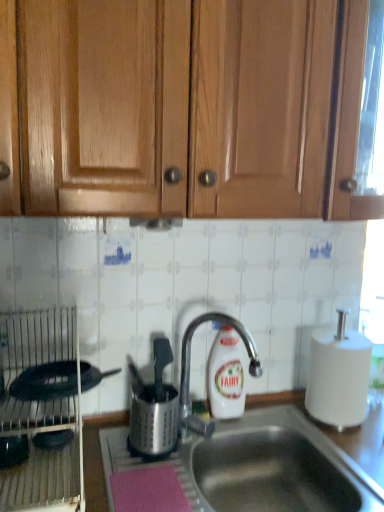
Where is `wooden cabinet doors at upper center`? wooden cabinet doors at upper center is located at coordinates (183, 108).

Describe the element at coordinates (338, 377) in the screenshot. I see `white matte paper towel at right` at that location.

Identify the location of white plastic bottle at center. (226, 375).

Describe the element at coordinates (226, 375) in the screenshot. I see `white plastic bottle at center` at that location.

Where is `stainless steel sink at center`? Image resolution: width=384 pixels, height=512 pixels. stainless steel sink at center is located at coordinates (279, 468).

Identify the location of silver metallic faucet at center. (189, 372).

The width and height of the screenshot is (384, 512). Identify the location of wooden cabinet doors at upper center. (183, 108).

Does white plastic bottle at center come in front of satin silver utensil holder at center, the 1th appliance from the right?

No, white plastic bottle at center is further to the viewer.

Consider the image. Visually, is white plastic bottle at center positioned to the left or to the right of satin silver utensil holder at center, which is counted as the 2th appliance, starting from the left?

white plastic bottle at center is to the right of satin silver utensil holder at center, which is counted as the 2th appliance, starting from the left.

Is point (222, 403) behind point (158, 446)?

Yes, it is.

Is point (337, 346) less distant than point (73, 412)?

No, it is not.

From the image's perspective, relative to metallic silver dish rack at left, which ranks as the first appliance in left-to-right order, is white matte paper towel at right above or below?

Clearly, from the image's perspective, white matte paper towel at right is above metallic silver dish rack at left, which ranks as the first appliance in left-to-right order.

Looking at this image, from a real-world perspective, is white matte paper towel at right physically below metallic silver dish rack at left, the second appliance viewed from the right?

Indeed, from a real-world perspective, white matte paper towel at right is positioned beneath metallic silver dish rack at left, the second appliance viewed from the right.

The width and height of the screenshot is (384, 512). I want to click on appliance that is the 2nd one when counting forward from the white matte paper towel at right, so click(41, 413).

From the image's perspective, is white plastic bottle at center located above or below metallic silver dish rack at left, the second appliance viewed from the right?

From the image's perspective, white plastic bottle at center appears below metallic silver dish rack at left, the second appliance viewed from the right.

Considering the sizes of objects white plastic bottle at center and metallic silver dish rack at left, the second appliance viewed from the right, in the image provided, who is taller, white plastic bottle at center or metallic silver dish rack at left, the second appliance viewed from the right,?

metallic silver dish rack at left, the second appliance viewed from the right.

I want to click on the 2nd appliance in front of the white plastic bottle at center, so click(x=41, y=413).

From the picture: From the image's perspective, which is below, silver metallic faucet at center or wooden cabinet doors at upper center?

silver metallic faucet at center appears lower in the image.

How many degrees apart are the facing directions of silver metallic faucet at center and wooden cabinet doors at upper center?

The angular difference between silver metallic faucet at center and wooden cabinet doors at upper center is 0.548 degrees.

At what (x,y) coordinates should I click in order to perform the action: click on tap that is under the wooden cabinet doors at upper center (from a real-world perspective). Please return your answer as a coordinate pair (x, y). This screenshot has height=512, width=384. Looking at the image, I should click on (189, 372).

Is silver metallic faucet at center located outside wooden cabinet doors at upper center?

silver metallic faucet at center lies outside wooden cabinet doors at upper center's area.

Is wooden cabinet doors at upper center inside stainless steel sink at center?

No.

Which object is closer to the camera taking this photo, stainless steel sink at center or wooden cabinet doors at upper center?

Positioned in front is wooden cabinet doors at upper center.

Considering the relative sizes of stainless steel sink at center and wooden cabinet doors at upper center in the image provided, is stainless steel sink at center thinner than wooden cabinet doors at upper center?

Yes, stainless steel sink at center is thinner than wooden cabinet doors at upper center.

From the picture: Is stainless steel sink at center placed right next to wooden cabinet doors at upper center?

No, stainless steel sink at center is not with wooden cabinet doors at upper center.

Does point (223, 202) come farther from viewer compared to point (244, 391)?

No.

Locate an element on the screen. This screenshot has width=384, height=512. cleaning product directly beneath the wooden cabinet doors at upper center (from a real-world perspective) is located at coordinates (226, 375).

Visually, is wooden cabinet doors at upper center positioned to the left or to the right of white plastic bottle at center?

wooden cabinet doors at upper center is positioned on white plastic bottle at center's right side.

From the image's perspective, which is above, wooden cabinet doors at upper center or white plastic bottle at center?

Answer: wooden cabinet doors at upper center.

Identify the location of tap on the left of white plastic bottle at center. (189, 372).

Considering the sizes of silver metallic faucet at center and white plastic bottle at center in the image, is silver metallic faucet at center taller or shorter than white plastic bottle at center?

In the image, silver metallic faucet at center appears to be taller than white plastic bottle at center.

From the image's perspective, does silver metallic faucet at center appear higher than white plastic bottle at center?

Yes, from the image's perspective, silver metallic faucet at center is over white plastic bottle at center.

The image size is (384, 512). What are the coordinates of `appliance that is under the white plastic bottle at center (from a real-world perspective)` in the screenshot? It's located at (153, 407).

Identify the location of the 1st appliance positioned below the white matte paper towel at right (from the image's perspective). Image resolution: width=384 pixels, height=512 pixels. (41, 413).

When comparing their distances from wooden cabinet doors at upper center, does silver metallic faucet at center or satin silver utensil holder at center, which is counted as the 2th appliance, starting from the left, seem closer?

Among the two, silver metallic faucet at center is located nearer to wooden cabinet doors at upper center.

From the image, which object appears to be nearer to metallic silver dish rack at left, which ranks as the first appliance in left-to-right order, white matte paper towel at right or stainless steel sink at center?

The object closer to metallic silver dish rack at left, which ranks as the first appliance in left-to-right order, is stainless steel sink at center.

When comparing their distances from satin silver utensil holder at center, which is counted as the 2th appliance, starting from the left, does metallic silver dish rack at left, which ranks as the first appliance in left-to-right order, or white matte paper towel at right seem further?

white matte paper towel at right is further to satin silver utensil holder at center, which is counted as the 2th appliance, starting from the left.

Estimate the real-world distances between objects in this image. Which object is further from wooden cabinet doors at upper center, metallic silver dish rack at left, which ranks as the first appliance in left-to-right order, or white matte paper towel at right?

The object further to wooden cabinet doors at upper center is white matte paper towel at right.

From the picture: When comparing their distances from satin silver utensil holder at center, the 1th appliance from the right, does stainless steel sink at center or white plastic bottle at center seem closer?

white plastic bottle at center.

Which object lies further to the anchor point stainless steel sink at center, white matte paper towel at right or wooden cabinet doors at upper center?

Based on the image, wooden cabinet doors at upper center appears to be further to stainless steel sink at center.

When comparing their distances from silver metallic faucet at center, does white plastic bottle at center or metallic silver dish rack at left, which ranks as the first appliance in left-to-right order, seem further?

metallic silver dish rack at left, which ranks as the first appliance in left-to-right order.

Which object lies further to the anchor point wooden cabinet doors at upper center, white matte paper towel at right or silver metallic faucet at center?

The object further to wooden cabinet doors at upper center is white matte paper towel at right.

This screenshot has width=384, height=512. I want to click on appliance between stainless steel sink at center and white plastic bottle at center from front to back, so click(153, 407).

At what (x,y) coordinates should I click in order to perform the action: click on appliance that lies between wooden cabinet doors at upper center and white plastic bottle at center from top to bottom. Please return your answer as a coordinate pair (x, y). This screenshot has height=512, width=384. Looking at the image, I should click on (41, 413).

Where is `appliance between silver metallic faucet at center and white plastic bottle at center in the front-back direction`? The image size is (384, 512). appliance between silver metallic faucet at center and white plastic bottle at center in the front-back direction is located at coordinates (153, 407).

Where is `appliance located between metallic silver dish rack at left, which ranks as the first appliance in left-to-right order, and white matte paper towel at right in the left-right direction`? appliance located between metallic silver dish rack at left, which ranks as the first appliance in left-to-right order, and white matte paper towel at right in the left-right direction is located at coordinates (153, 407).